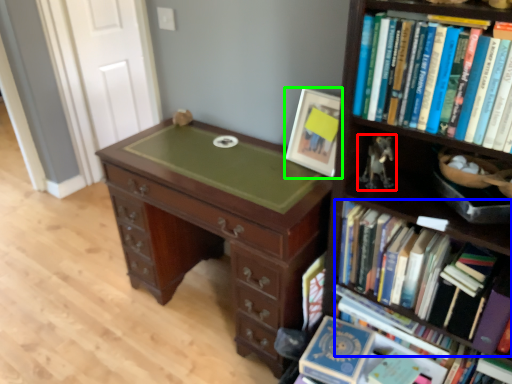
Question: Considering the real-world distances, which object is closest to toy (highlighted by a red box)? book (highlighted by a blue box) or picture frame (highlighted by a green box).

Choices:
 (A) book
 (B) picture frame

Answer: (B)